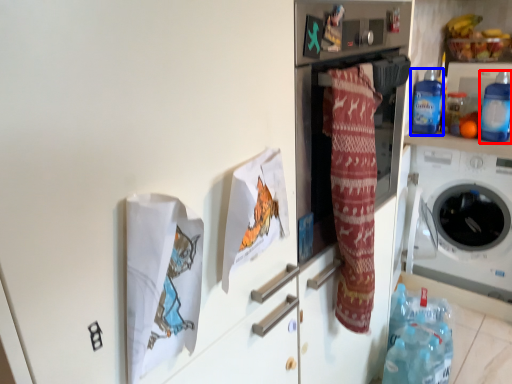
Question: Which object is closer to the camera taking this photo, bottle (highlighted by a red box) or bottle (highlighted by a blue box)?

Choices:
 (A) bottle
 (B) bottle

Answer: (A)